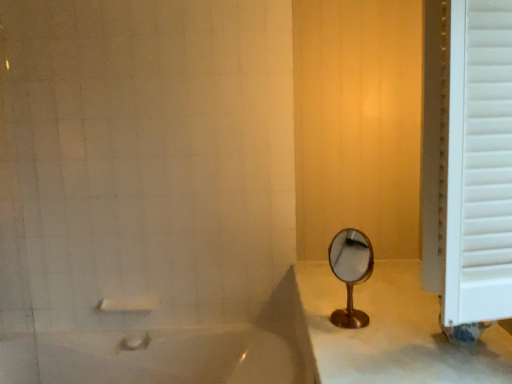
I want to click on free space to the back side of gold metallic mirror at center, so click(x=324, y=290).